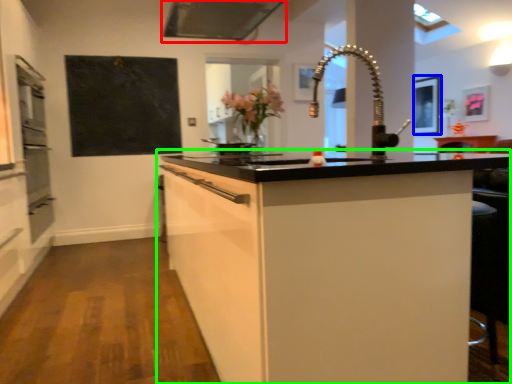
Question: Which object is positioned farthest from exhaust hood (highlighted by a red box)? Select from picture frame (highlighted by a blue box) and cabinetry (highlighted by a green box).

Choices:
 (A) picture frame
 (B) cabinetry

Answer: (A)